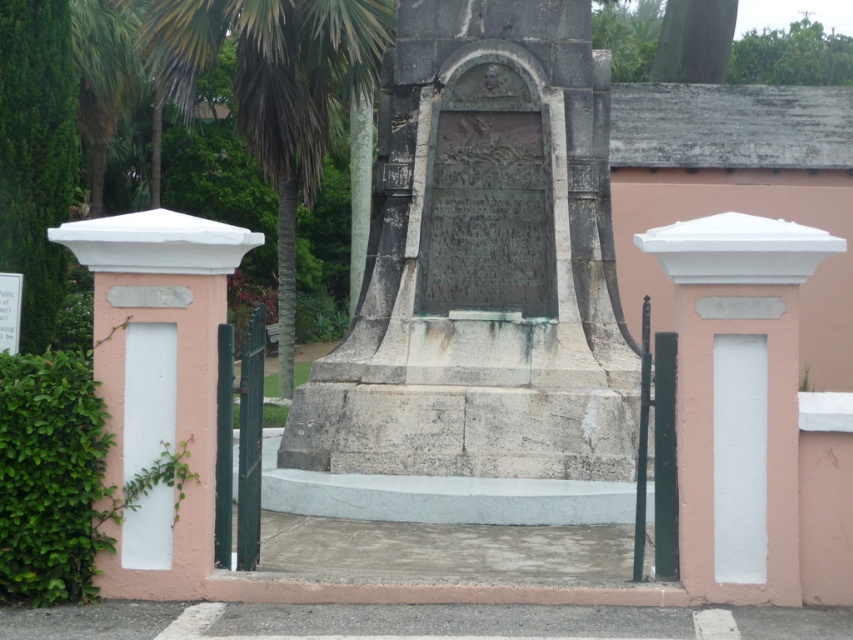
Question: Where is gray stone monument at center located in relation to green leafy palm tree at center in the image?

Choices:
 (A) right
 (B) left

Answer: (A)

Question: Among these points, which one is nearest to the camera?

Choices:
 (A) (170, 13)
 (B) (498, 45)

Answer: (B)

Question: Where is gray stone monument at center located in relation to green leafy palm tree at center in the image?

Choices:
 (A) below
 (B) above

Answer: (A)

Question: Is gray stone monument at center wider than green leafy palm tree at center?

Choices:
 (A) yes
 (B) no

Answer: (B)